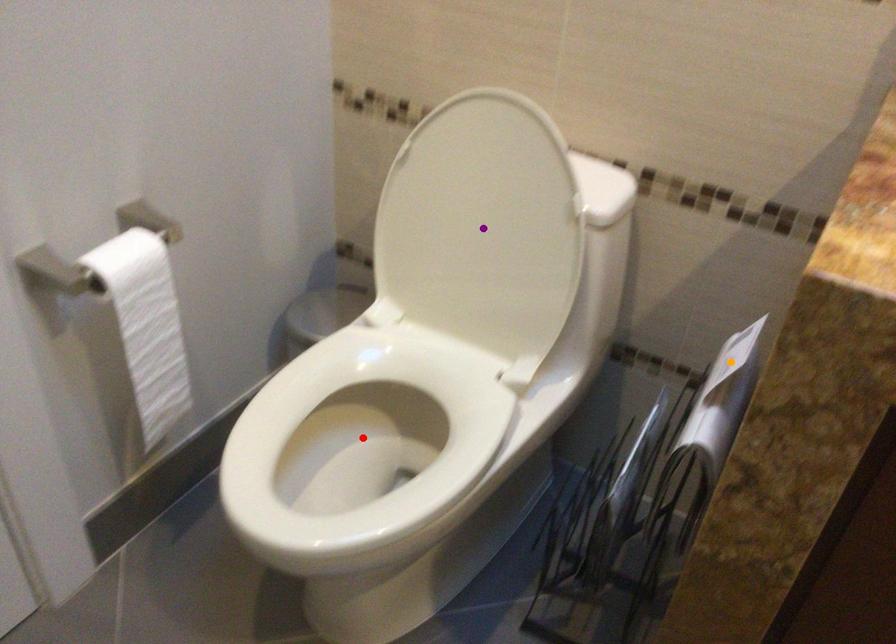
Order these from nearest to farthest:
A) orange point
B) purple point
C) red point

orange point < red point < purple point